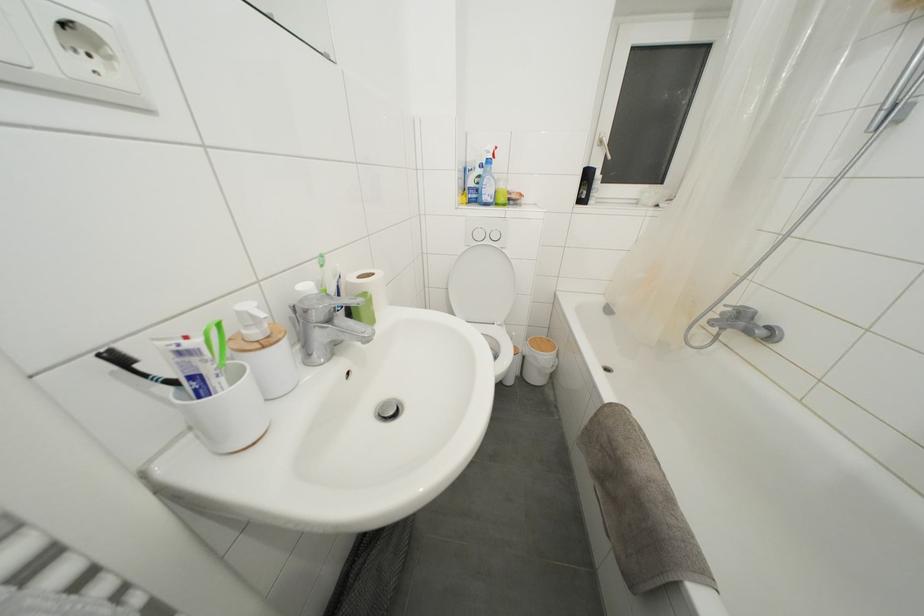
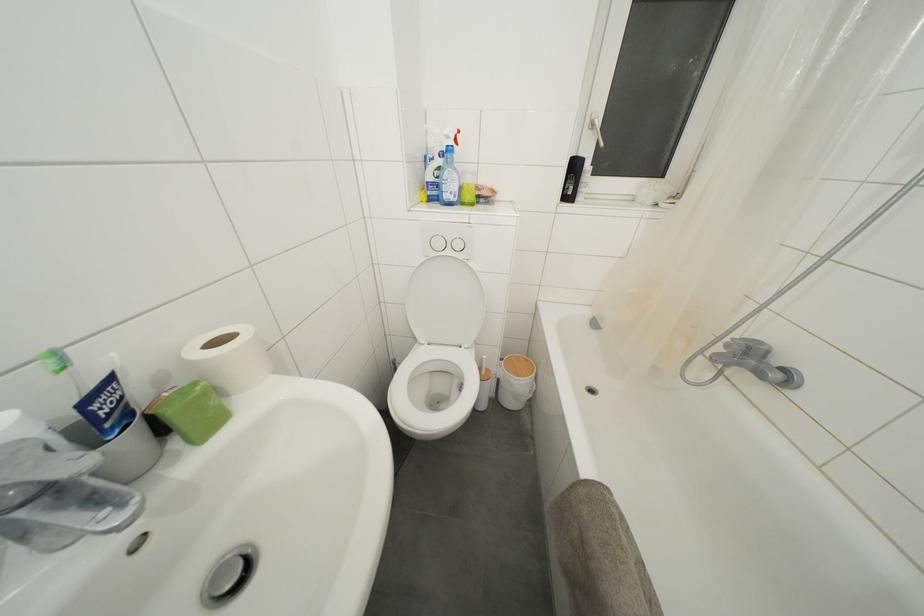
Where in the second image is the point corresponding to (x=492, y=153) from the first image?

(450, 138)